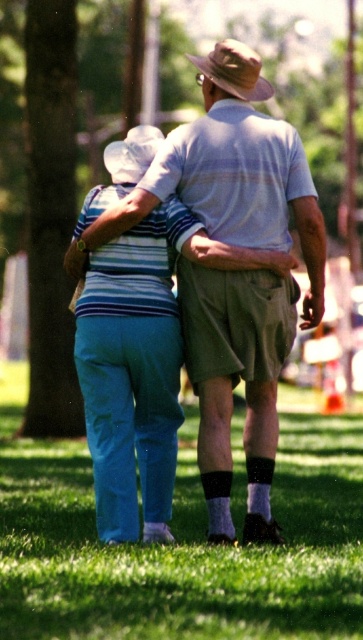
Is striped fabric shirt at center above brown felt hat at upper center?

Actually, striped fabric shirt at center is below brown felt hat at upper center.

Looking at this image, does striped fabric shirt at center appear on the left side of brown felt hat at upper center?

Correct, you'll find striped fabric shirt at center to the left of brown felt hat at upper center.

Does point (275, 241) come closer to viewer compared to point (221, 81)?

Yes, it is.

Where is `striped fabric shirt at center`? This screenshot has height=640, width=363. striped fabric shirt at center is located at coordinates (230, 188).

Does point (11, 406) come closer to viewer compared to point (197, 80)?

Yes.

Does green grass at lower center have a greater width compared to brown felt hat at upper center?

Correct, the width of green grass at lower center exceeds that of brown felt hat at upper center.

Describe the element at coordinates (180, 544) in the screenshot. I see `green grass at lower center` at that location.

Where is `green grass at lower center`? green grass at lower center is located at coordinates (180, 544).

Is green grass at lower center shorter than striped fabric shirt at center?

Correct, green grass at lower center is not as tall as striped fabric shirt at center.

Does green grass at lower center appear over striped fabric shirt at center?

No, green grass at lower center is not above striped fabric shirt at center.

The image size is (363, 640). In order to click on green grass at lower center in this screenshot , I will do `click(180, 544)`.